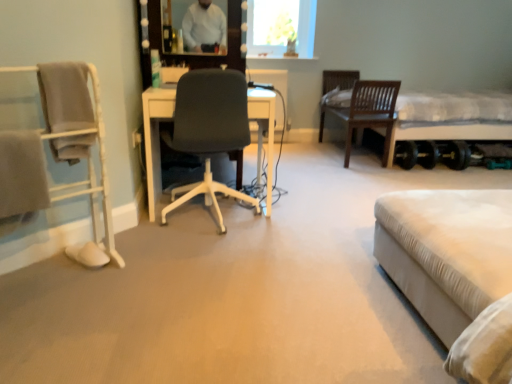
Question: Could you tell me if white fabric bed at right, arranged as the 2th bed when viewed from the left, is facing white fabric bed at lower right, which ranks as the 1th bed in bottom-to-top order?

Choices:
 (A) yes
 (B) no

Answer: (B)

Question: Does white fabric bed at right, the 2th bed from the bottom, lie in front of white fabric bed at lower right, the second bed from the back?

Choices:
 (A) yes
 (B) no

Answer: (B)

Question: Is there a large distance between white fabric bed at right, the 2th bed from the bottom, and white fabric bed at lower right, acting as the 2th bed starting from the top?

Choices:
 (A) yes
 (B) no

Answer: (A)

Question: Is white fabric bed at right, arranged as the first bed when viewed from the right, facing away from white fabric bed at lower right, the second bed from the back?

Choices:
 (A) yes
 (B) no

Answer: (B)

Question: Are white fabric bed at right, the 1th bed positioned from the top, and white fabric bed at lower right, placed as the 1th bed when sorted from left to right, making contact?

Choices:
 (A) no
 (B) yes

Answer: (A)

Question: Relative to matte white mirror at upper center, is transparent glass vase at upper center in front or behind?

Choices:
 (A) front
 (B) behind

Answer: (B)

Question: In terms of size, does transparent glass vase at upper center appear bigger or smaller than matte white mirror at upper center?

Choices:
 (A) small
 (B) big

Answer: (B)

Question: From the image's perspective, is transparent glass vase at upper center positioned above or below matte white mirror at upper center?

Choices:
 (A) below
 (B) above

Answer: (B)

Question: Is point (306, 26) positioned closer to the camera than point (195, 23)?

Choices:
 (A) closer
 (B) farther

Answer: (B)

Question: From the image's perspective, relative to white fabric bed at right, the 1th bed when ordered from back to front, is white fabric bed at lower right, acting as the 2th bed starting from the top, above or below?

Choices:
 (A) above
 (B) below

Answer: (B)

Question: From a real-world perspective, is white fabric bed at lower right, the first bed when ordered from front to back, positioned above or below white fabric bed at right, arranged as the 2th bed when viewed from the left?

Choices:
 (A) above
 (B) below

Answer: (B)

Question: Considering their positions, is white fabric bed at lower right, acting as the 2th bed starting from the top, located in front of or behind white fabric bed at right, the 1th bed when ordered from back to front?

Choices:
 (A) behind
 (B) front

Answer: (B)

Question: From their relative heights in the image, would you say white fabric bed at lower right, the second bed from the back, is taller or shorter than white fabric bed at right, the 2th bed from the bottom?

Choices:
 (A) short
 (B) tall

Answer: (A)

Question: In the image, is white fabric bed at right, the 1th bed when ordered from back to front, on the left side or the right side of white fabric chair at left, placed as the 1th chair when sorted from left to right?

Choices:
 (A) left
 (B) right

Answer: (B)

Question: Based on their sizes in the image, would you say white fabric bed at right, arranged as the first bed when viewed from the right, is bigger or smaller than white fabric chair at left, positioned as the 3th chair in back-to-front order?

Choices:
 (A) small
 (B) big

Answer: (B)